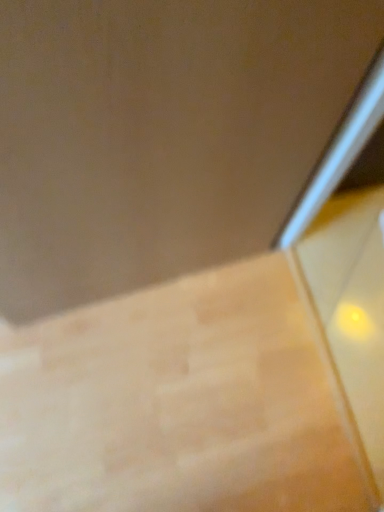
What do you see at coordinates (179, 404) in the screenshot? I see `beige marble stairs at lower right` at bounding box center [179, 404].

At what (x,y) coordinates should I click in order to perform the action: click on beige marble stairs at lower right. Please return your answer as a coordinate pair (x, y). Looking at the image, I should click on (179, 404).

Where is `beige marble stairs at lower right`? The width and height of the screenshot is (384, 512). beige marble stairs at lower right is located at coordinates (179, 404).